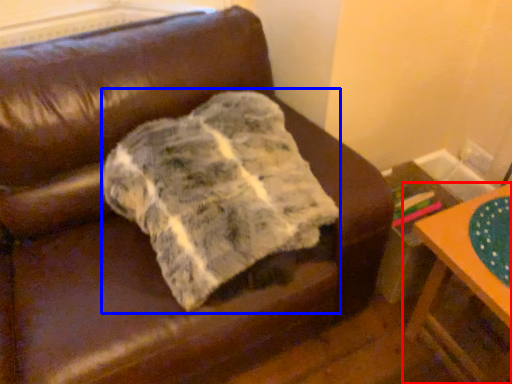
Question: Among these objects, which one is nearest to the camera, table (highlighted by a red box) or blanket (highlighted by a blue box)?

Choices:
 (A) table
 (B) blanket

Answer: (B)